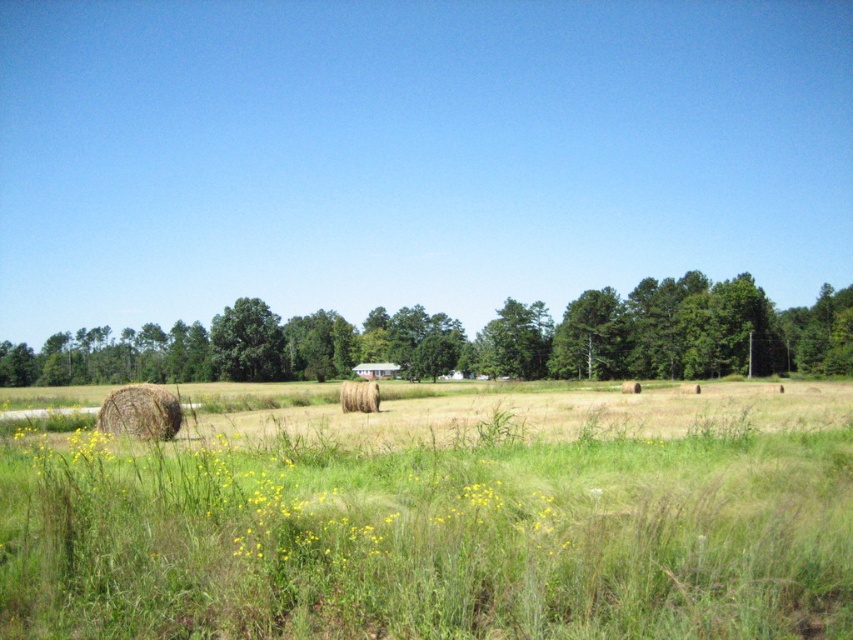
You are standing in the rural landscape and want to move from the point closer to you to the point further away. Which path would you take between the two points, point (428,333) and point (125,426)?

The point further to the viewer is point (428,333), so to move from the closer point to the further one, you should head towards point (125,426).